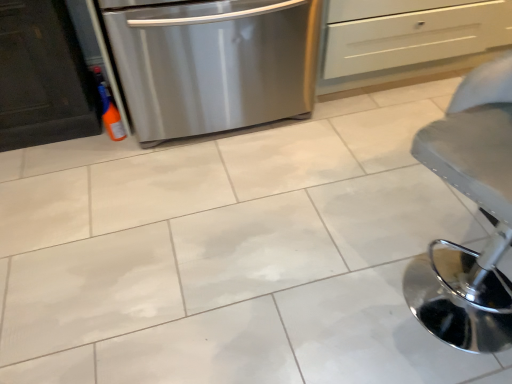
Identify the location of free spot behind metallic gray stool at lower right. (401, 200).